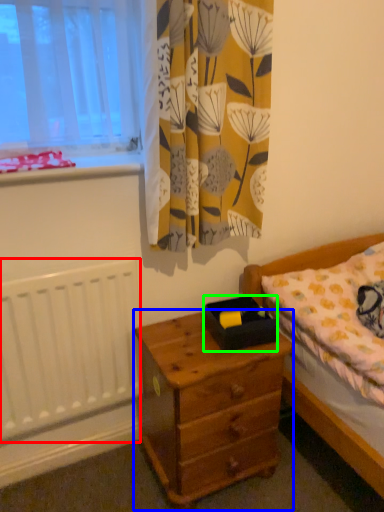
Question: Estimate the real-world distances between objects in this image. Which object is farther from radiator (highlighted by a red box), nightstand (highlighted by a blue box) or box (highlighted by a green box)?

Choices:
 (A) nightstand
 (B) box

Answer: (B)